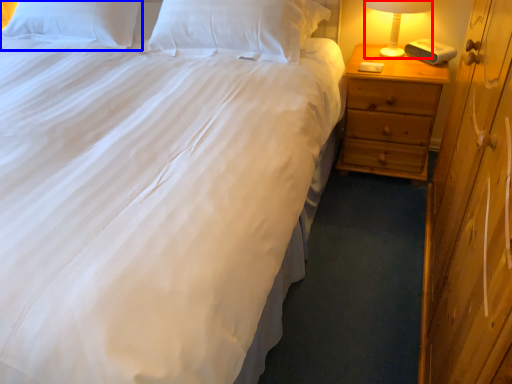
Question: Which point is closer to the camera, bedside lamp (highlighted by a red box) or pillow (highlighted by a blue box)?

Choices:
 (A) bedside lamp
 (B) pillow

Answer: (A)